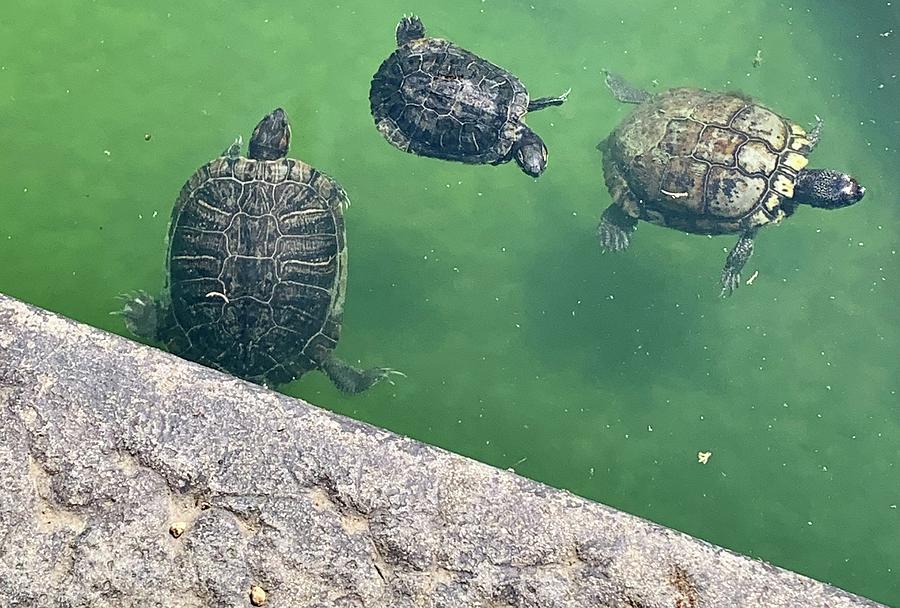
In order to click on concrete wall in this screenshot , I will do `click(129, 492)`, `click(392, 550)`.